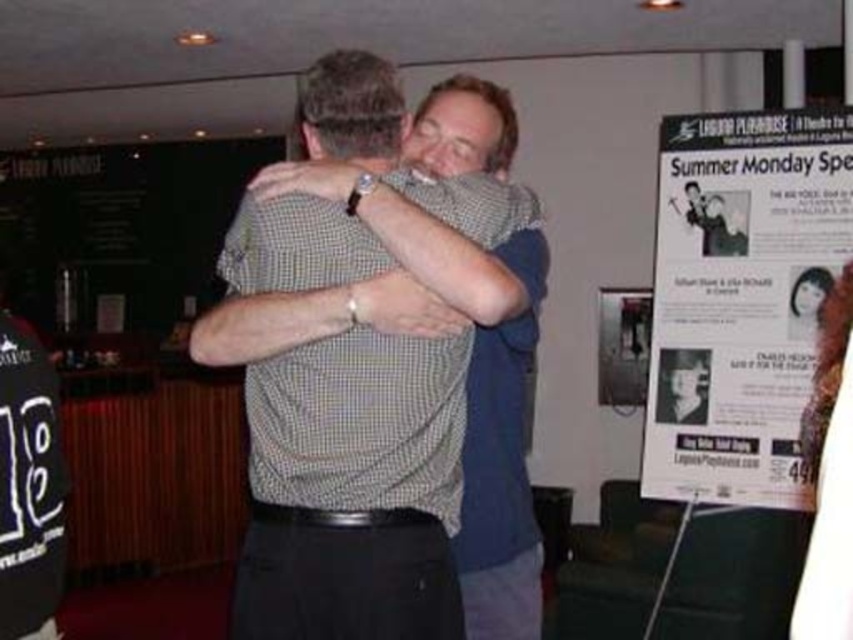
Question: Which point is closer to the camera taking this photo?

Choices:
 (A) (299, 356)
 (B) (839, 269)
 (C) (805, 289)

Answer: (A)

Question: Is checkered fabric shirt at center to the left of white paper poster at right from the viewer's perspective?

Choices:
 (A) no
 (B) yes

Answer: (B)

Question: Among these objects, which one is farthest from the camera?

Choices:
 (A) white paper poster at right
 (B) checkered fabric shirt at center

Answer: (A)

Question: Considering the relative positions of checkered fabric shirt at center and white paper poster at right in the image provided, where is checkered fabric shirt at center located with respect to white paper poster at right?

Choices:
 (A) left
 (B) right

Answer: (A)

Question: Considering the relative positions of white paper poster at right and smooth black hair at upper right in the image provided, where is white paper poster at right located with respect to smooth black hair at upper right?

Choices:
 (A) right
 (B) left

Answer: (B)

Question: Which object is farther from the camera taking this photo?

Choices:
 (A) checkered fabric shirt at center
 (B) smooth black hair at upper right

Answer: (B)